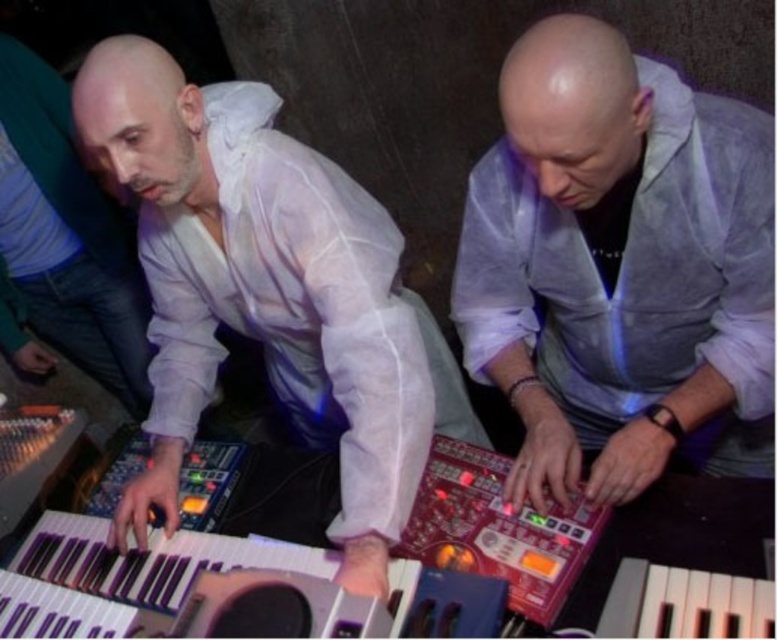
In the scene shown: Who is lower down, translucent white shirt at center or metallic keyboard at lower left?

Positioned lower is metallic keyboard at lower left.

Does translucent white shirt at center come in front of metallic keyboard at lower left?

That is False.

Does point (607, 29) come farther from viewer compared to point (181, 580)?

No.

You are a GUI agent. You are given a task and a screenshot of the screen. Output one action in this format:
    pyautogui.click(x=<x>, y=<y>)
    Task: Click on the translucent white shirt at center
    The height and width of the screenshot is (640, 778).
    Given the screenshot: What is the action you would take?
    tap(619, 268)

From the picture: Does translucent white shirt at center come in front of white sheer shirt at center?

Yes, it is.

Consider the image. Between translucent white shirt at center and white sheer shirt at center, which one has less height?

translucent white shirt at center is shorter.

This screenshot has height=640, width=778. What are the coordinates of `translucent white shirt at center` in the screenshot? It's located at (619, 268).

Is white sheer shirt at center bigger than metallic keyboard at lower left?

Correct, white sheer shirt at center is larger in size than metallic keyboard at lower left.

In the scene shown: Does white sheer shirt at center have a smaller size compared to metallic keyboard at lower left?

Incorrect, white sheer shirt at center is not smaller in size than metallic keyboard at lower left.

In order to click on white sheer shirt at center in this screenshot , I will do `click(268, 292)`.

Where is `white sheer shirt at center`? The width and height of the screenshot is (778, 640). white sheer shirt at center is located at coordinates (268, 292).